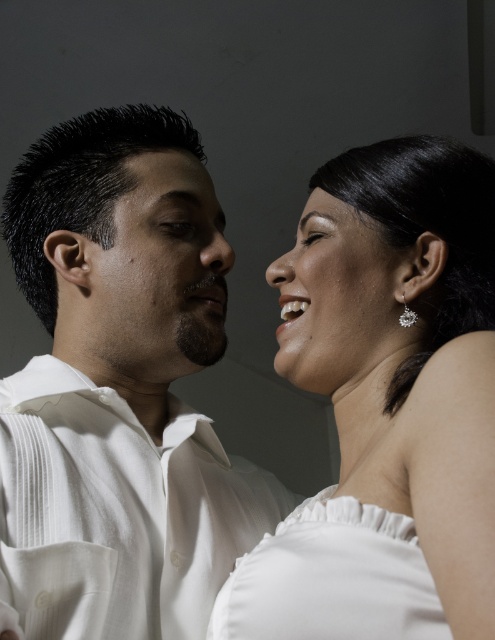
Question: Does white satin dress at center have a lesser width compared to matte skin forehead at upper center?

Choices:
 (A) no
 (B) yes

Answer: (A)

Question: Which of the following is the farthest from the observer?

Choices:
 (A) white satin dress at center
 (B) white pleated shirt at center
 (C) satin white earring at upper right
 (D) matte skin forehead at upper center

Answer: (D)

Question: Estimate the real-world distances between objects in this image. Which object is farther from the white satin dress at center?

Choices:
 (A) matte skin forehead at upper center
 (B) white pleated shirt at center

Answer: (A)

Question: Is the position of white satin dress at center less distant than that of matte skin forehead at upper center?

Choices:
 (A) no
 (B) yes

Answer: (B)

Question: Does white pleated shirt at center appear under clear crystal earring at upper right?

Choices:
 (A) yes
 (B) no

Answer: (A)

Question: Which object is closer to the camera taking this photo?

Choices:
 (A) white pleated shirt at center
 (B) matte skin forehead at upper center
 (C) smooth skin face at center

Answer: (A)